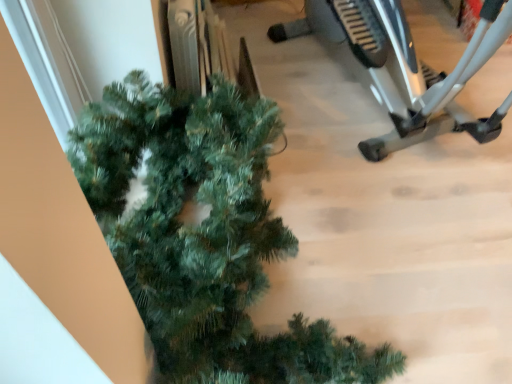
Question: Is green matte christmas tree at lower left not within silver metallic stationary bicycle at right?

Choices:
 (A) no
 (B) yes

Answer: (B)

Question: From the image's perspective, is green matte christmas tree at lower left below silver metallic stationary bicycle at right?

Choices:
 (A) no
 (B) yes

Answer: (B)

Question: Does green matte christmas tree at lower left touch silver metallic stationary bicycle at right?

Choices:
 (A) yes
 (B) no

Answer: (B)

Question: Is green matte christmas tree at lower left oriented away from silver metallic stationary bicycle at right?

Choices:
 (A) no
 (B) yes

Answer: (A)

Question: Is green matte christmas tree at lower left to the left of silver metallic stationary bicycle at right from the viewer's perspective?

Choices:
 (A) yes
 (B) no

Answer: (A)

Question: From a real-world perspective, is green matte christmas tree at lower left positioned under silver metallic stationary bicycle at right based on gravity?

Choices:
 (A) no
 (B) yes

Answer: (B)

Question: Is the position of silver metallic stationary bicycle at right more distant than that of green matte christmas tree at lower left?

Choices:
 (A) no
 (B) yes

Answer: (B)

Question: From the image's perspective, is silver metallic stationary bicycle at right located beneath green matte christmas tree at lower left?

Choices:
 (A) yes
 (B) no

Answer: (B)

Question: Is silver metallic stationary bicycle at right looking in the opposite direction of green matte christmas tree at lower left?

Choices:
 (A) no
 (B) yes

Answer: (A)

Question: Is silver metallic stationary bicycle at right next to green matte christmas tree at lower left?

Choices:
 (A) yes
 (B) no

Answer: (B)

Question: From a real-world perspective, is silver metallic stationary bicycle at right over green matte christmas tree at lower left?

Choices:
 (A) yes
 (B) no

Answer: (A)

Question: Is silver metallic stationary bicycle at right thinner than green matte christmas tree at lower left?

Choices:
 (A) yes
 (B) no

Answer: (B)

Question: From a real-world perspective, relative to green matte christmas tree at lower left, is silver metallic stationary bicycle at right vertically above or below?

Choices:
 (A) below
 (B) above

Answer: (B)